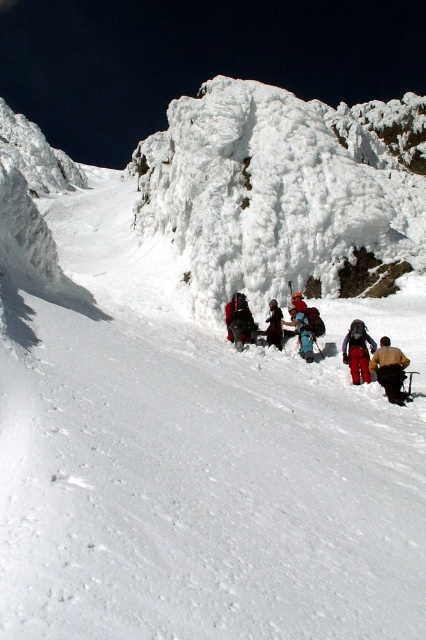
Between point (397, 378) and point (359, 324), which one is positioned behind?

The point (359, 324) is more distant.

How much distance is there between yellow fabric jacket at lower right and red fabric pants at lower right?

yellow fabric jacket at lower right and red fabric pants at lower right are 6.50 meters apart.

I want to click on yellow fabric jacket at lower right, so click(x=389, y=369).

Looking at this image, who is shorter, red fabric pants at lower right or blue fabric backpack at center?

Standing shorter between the two is red fabric pants at lower right.

What are the coordinates of `red fabric pants at lower right` in the screenshot? It's located at (357, 352).

Does point (354, 349) come behind point (294, 321)?

No, it is in front of (294, 321).

Locate an element on the screen. The height and width of the screenshot is (640, 426). red fabric pants at lower right is located at coordinates (357, 352).

Does yellow fabric jacket at lower right have a smaller size compared to red fabric jacket at center?

Actually, yellow fabric jacket at lower right might be larger than red fabric jacket at center.

Measure the distance between yellow fabric jacket at lower right and camera.

yellow fabric jacket at lower right is 45.58 meters from camera.

Who is more distant from viewer, (388, 396) or (238, 332)?

Point (238, 332)

Image resolution: width=426 pixels, height=640 pixels. I want to click on yellow fabric jacket at lower right, so click(389, 369).